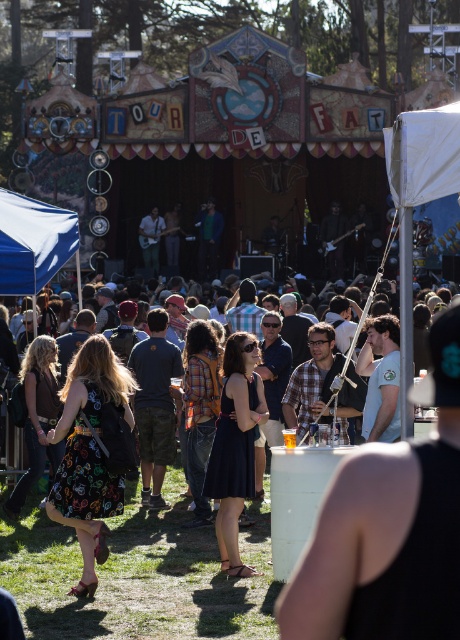
Question: Which object is closer to the camera taking this photo?

Choices:
 (A) dark blue dress at center
 (B) blue fabric canopy at upper left
 (C) printed fabric dress at center
 (D) white fabric canopy at upper right

Answer: (D)

Question: In this image, where is printed fabric dress at center located relative to blue fabric canopy at upper left?

Choices:
 (A) above
 (B) below

Answer: (B)

Question: Which object appears closest to the camera in this image?

Choices:
 (A) white fabric canopy at upper right
 (B) dark blue dress at center
 (C) printed fabric dress at center

Answer: (A)

Question: Is white fabric canopy at upper right positioned behind blue fabric canopy at upper left?

Choices:
 (A) no
 (B) yes

Answer: (A)

Question: Which point is farther to the camera?

Choices:
 (A) dark blue dress at center
 (B) white fabric canopy at upper right
 (C) printed fabric dress at center

Answer: (A)

Question: Is printed fabric dress at center to the left of blue fabric canopy at upper left from the viewer's perspective?

Choices:
 (A) yes
 (B) no

Answer: (B)